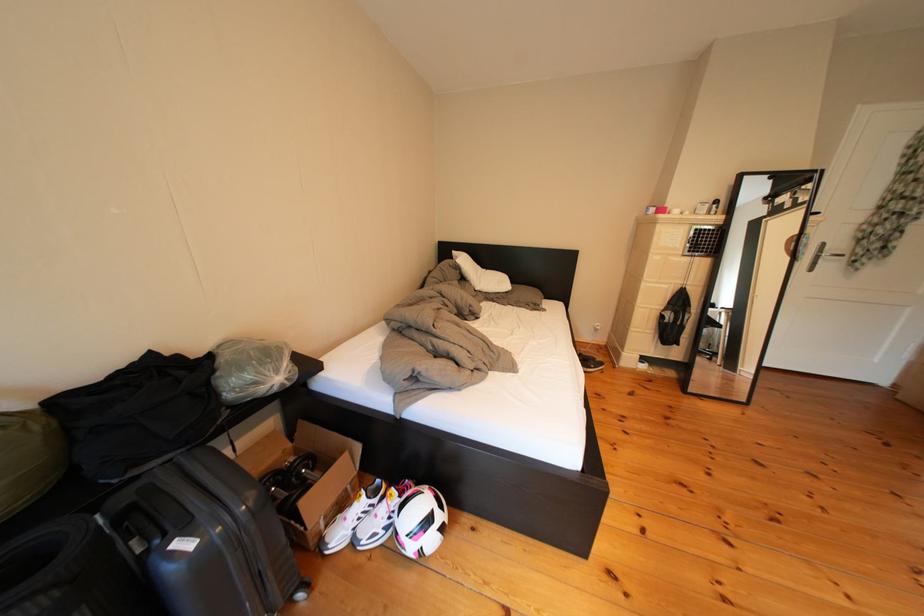
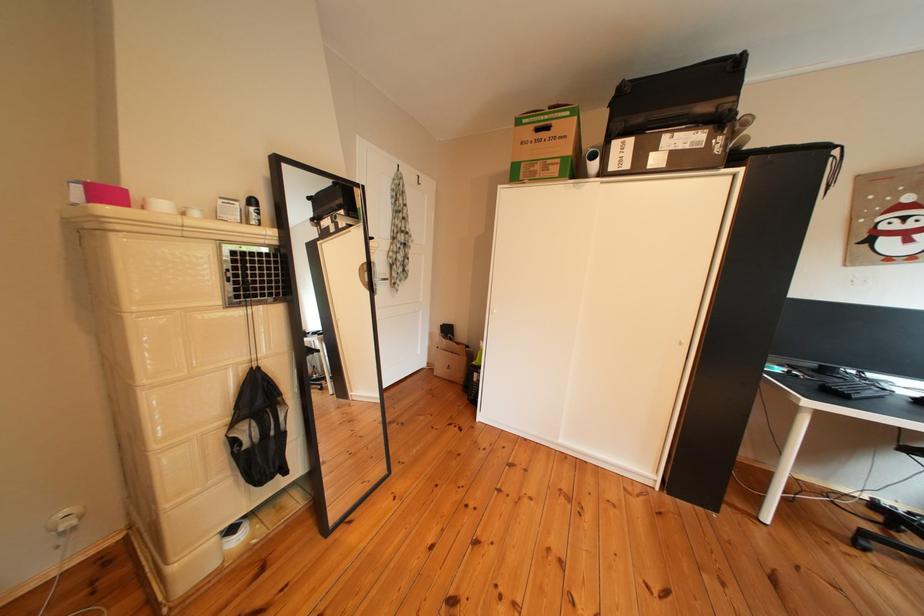
The point at (723, 217) is marked in the first image. Where is the corresponding point in the second image?

(259, 225)